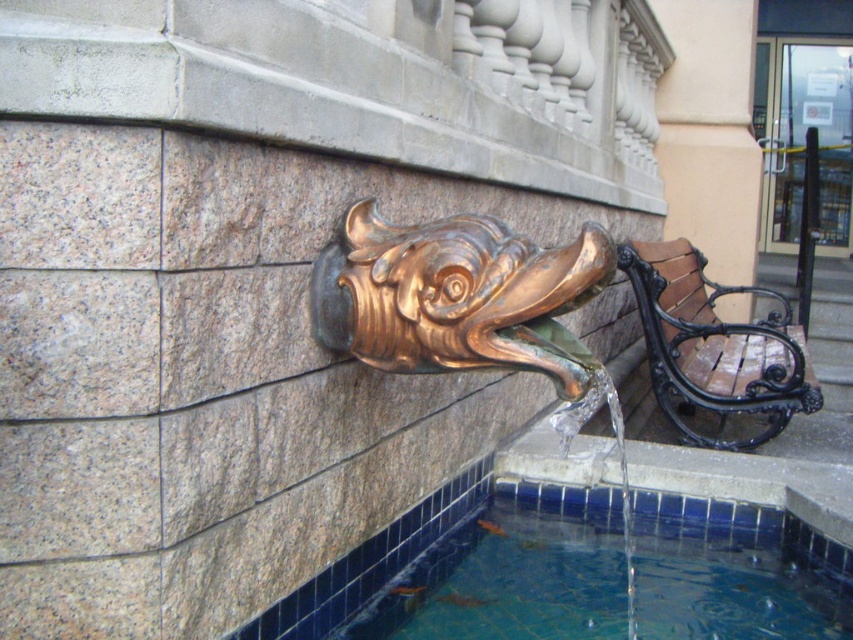
Who is taller, gold polished fish head at center or shiny bronze fish at center?

Standing taller between the two is gold polished fish head at center.

Who is positioned more to the left, gold polished fish head at center or shiny bronze fish at center?

shiny bronze fish at center is more to the left.

Identify the location of gold polished fish head at center. The width and height of the screenshot is (853, 640). (553, 321).

Is clear glass water at lower center shorter than brown wooden bench at right?

Yes.

Is point (820, 618) positioned behind point (780, 408)?

No, (820, 618) is closer to viewer.

Between point (544, 621) and point (660, 340), which one is positioned behind?

The point (660, 340) is more distant.

What are the coordinates of `clear glass water at lower center` in the screenshot? It's located at (512, 573).

Does shiny bronze fish at center appear under brown wooden bench at right?

Indeed, shiny bronze fish at center is positioned under brown wooden bench at right.

Which is more to the right, shiny bronze fish at center or brown wooden bench at right?

From the viewer's perspective, brown wooden bench at right appears more on the right side.

Which is in front, point (573, 275) or point (778, 392)?

Point (573, 275)

Image resolution: width=853 pixels, height=640 pixels. In order to click on shiny bronze fish at center in this screenshot , I will do `click(456, 296)`.